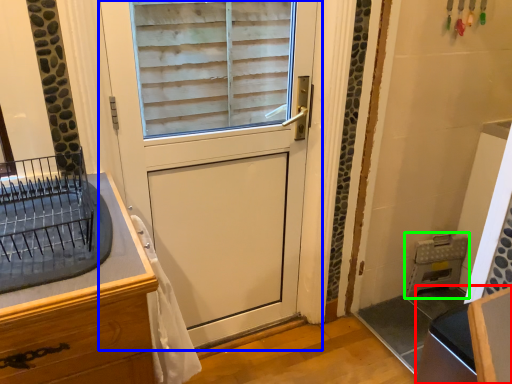
Question: Based on their relative distances, which object is nearer to vanity (highlighted by a red box)? Choose from door (highlighted by a blue box) and appliance (highlighted by a green box).

Choices:
 (A) door
 (B) appliance

Answer: (A)